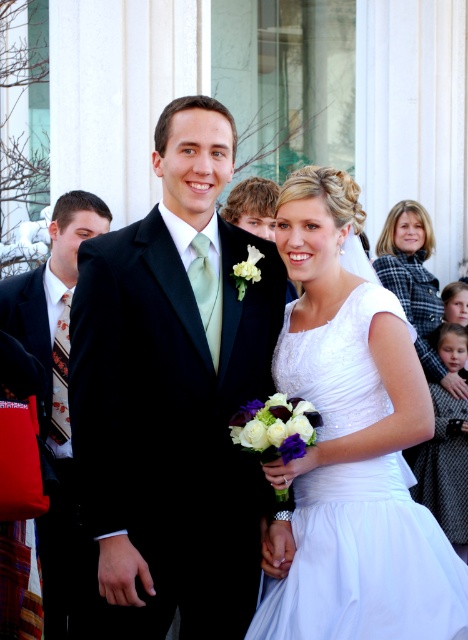
Can you confirm if matte black suit at center is taller than matte black suit at left?

Yes.

Can you confirm if matte black suit at center is shorter than matte black suit at left?

No, matte black suit at center is not shorter than matte black suit at left.

Between point (204, 324) and point (24, 285), which one is positioned in front?

Point (204, 324)

The width and height of the screenshot is (468, 640). What are the coordinates of `matte black suit at center` in the screenshot? It's located at (174, 394).

Between point (49, 326) and point (399, 244), which one is positioned behind?

Point (399, 244)

The width and height of the screenshot is (468, 640). What are the coordinates of `matte black suit at left` in the screenshot? It's located at pos(51,394).

Which is in front, point (255, 241) or point (430, 237)?

Point (255, 241)

From the picture: Is matte black suit at center further to the viewer compared to white satin dress at right?

No, it is not.

The height and width of the screenshot is (640, 468). Find the location of `matte black suit at center`. matte black suit at center is located at coordinates (174, 394).

What are the coordinates of `matte black suit at center` in the screenshot? It's located at (174, 394).